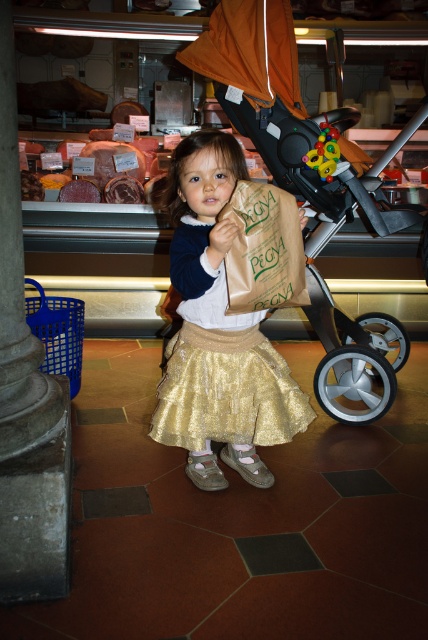
Question: Is gold shimmering skirt at center in front of gold sequined skirt at center?

Choices:
 (A) no
 (B) yes

Answer: (B)

Question: Which of the following is the closest to the observer?

Choices:
 (A) gold shimmering skirt at center
 (B) matte black stroller at center
 (C) brown paper bag at center
 (D) gold sequined skirt at center

Answer: (A)

Question: Which point is closer to the camera?

Choices:
 (A) matte black stroller at center
 (B) gold sequined skirt at center
 (C) gold shimmering skirt at center

Answer: (C)

Question: Among these objects, which one is farthest from the camera?

Choices:
 (A) gold shimmering skirt at center
 (B) matte black stroller at center
 (C) gold sequined skirt at center

Answer: (B)

Question: Is gold shimmering skirt at center in front of gold sequined skirt at center?

Choices:
 (A) no
 (B) yes

Answer: (B)

Question: Can you confirm if matte black stroller at center is positioned to the right of brown paper bag at center?

Choices:
 (A) yes
 (B) no

Answer: (A)